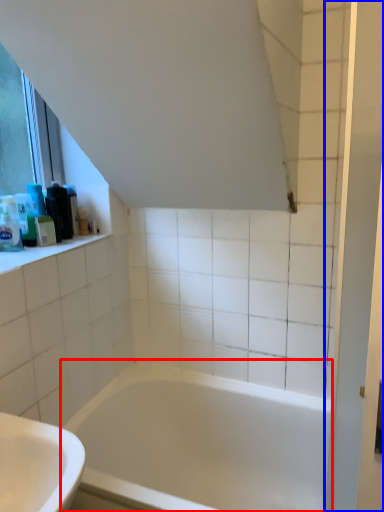
Question: Which object appears farthest to the camera in this image, bathtub (highlighted by a red box) or screen door (highlighted by a blue box)?

Choices:
 (A) bathtub
 (B) screen door

Answer: (A)